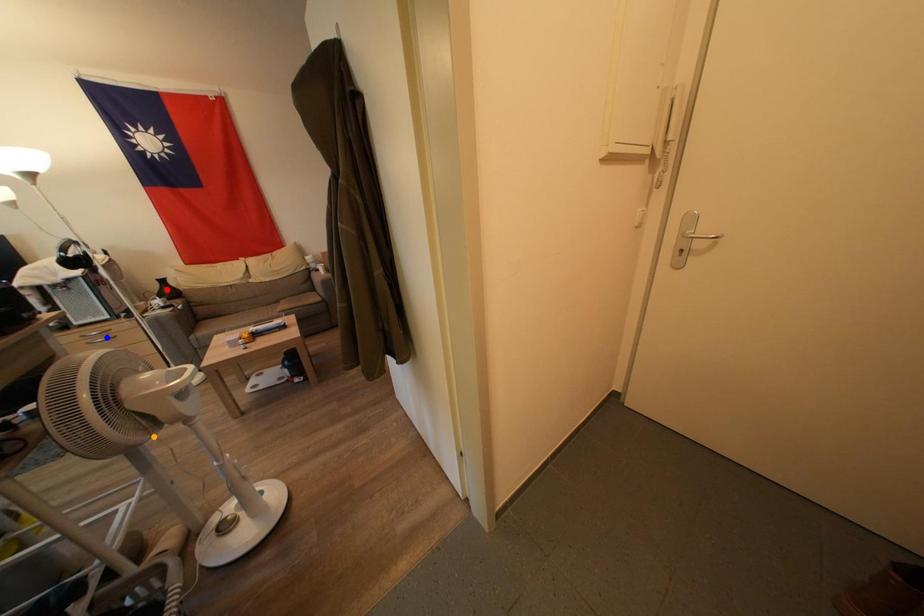
Order these from farthest to nearest:
- blue point
- orange point
- red point

red point < blue point < orange point